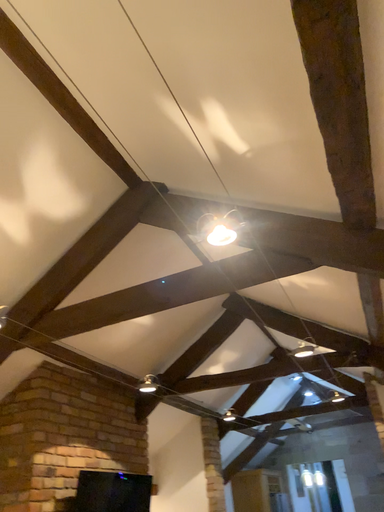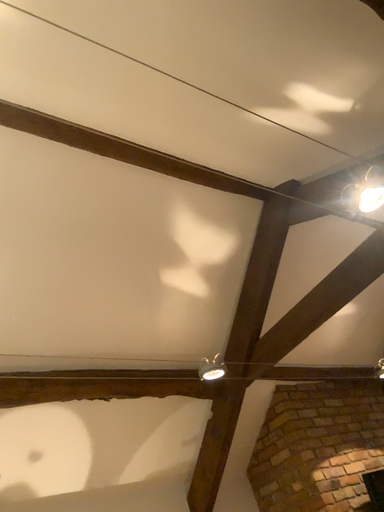
Question: Which way did the camera rotate in the video?

Choices:
 (A) rotated right
 (B) rotated left

Answer: (B)